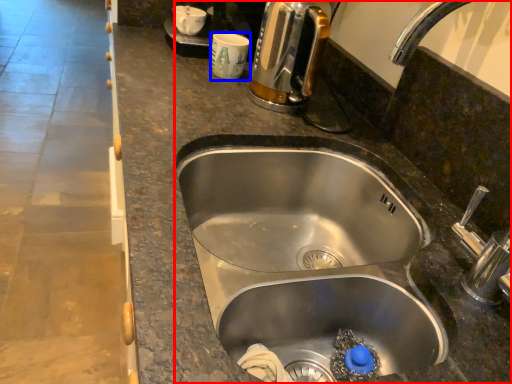
Question: Which object is further to the camera taking this photo, sink (highlighted by a red box) or coffee cup (highlighted by a blue box)?

Choices:
 (A) sink
 (B) coffee cup

Answer: (B)